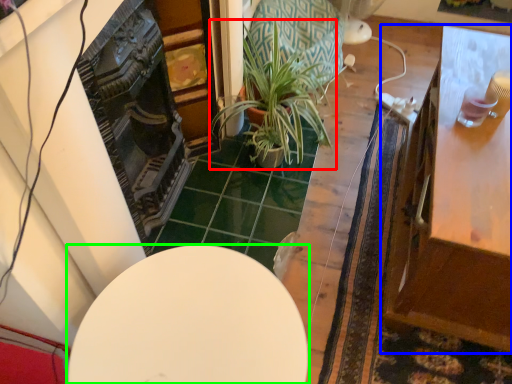
Question: Which object is positioned farthest from houseplant (highlighted by a red box)? Select from table (highlighted by a blue box) and table (highlighted by a green box).

Choices:
 (A) table
 (B) table

Answer: (B)